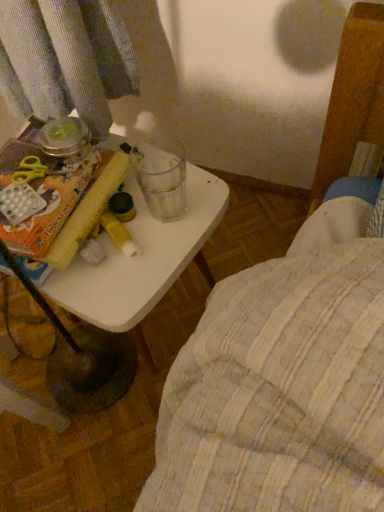
You are a GUI agent. You are given a task and a screenshot of the screen. Output one action in this format:
    pyautogui.click(x=<x>, y=<y>)
    Task: Click on the white plastic table at center
    The image size is (384, 512).
    Given the screenshot: What is the action you would take?
    pyautogui.click(x=143, y=261)

Image resolution: width=384 pixels, height=512 pixels. Describe the element at coordinates (143, 261) in the screenshot. I see `white plastic table at center` at that location.

Locate an element on the screen. The image size is (384, 512). yellow paper at left is located at coordinates (40, 194).

The width and height of the screenshot is (384, 512). What do you see at coordinates (40, 194) in the screenshot?
I see `yellow paper at left` at bounding box center [40, 194].

You are a GUI agent. You are given a task and a screenshot of the screen. Output one action in this format:
    pyautogui.click(x=<x>, y=<y>)
    Task: Click on the white plastic table at center
    The width and height of the screenshot is (384, 512).
    Given the screenshot: What is the action you would take?
    pyautogui.click(x=143, y=261)

Based on the photo, would you say white plastic table at center is to the left or to the right of yellow paper at left in the picture?

Based on their positions, white plastic table at center is located to the right of yellow paper at left.

Which object is closer to the camera, white plastic table at center or yellow paper at left?

yellow paper at left is closer to the camera.

Is point (219, 187) positioned in front of point (14, 194)?

No, (219, 187) is further to viewer.

From the image's perspective, which object appears higher, white plastic table at center or yellow paper at left?

yellow paper at left appears higher in the image.

From a real-world perspective, is white plastic table at center on top of yellow paper at left?

No, from a real-world perspective, white plastic table at center is not above yellow paper at left.

Can you confirm if white plastic table at center is thinner than yellow paper at left?

No.

Is white plastic table at center taller or shorter than yellow paper at left?

In the image, white plastic table at center appears to be taller than yellow paper at left.

Can you confirm if white plastic table at center is smaller than yellow paper at left?

Actually, white plastic table at center might be larger than yellow paper at left.

Is white plastic table at center outside of yellow paper at left?

Yes, white plastic table at center is outside of yellow paper at left.

Looking at this image, is white plastic table at center far away from yellow paper at left?

No, there isn't a large distance between white plastic table at center and yellow paper at left.

Is white plastic table at center aimed at yellow paper at left?

No, white plastic table at center is not turned towards yellow paper at left.

How much distance is there between white plastic table at center and yellow paper at left?

4.14 inches.

Locate an element on the screen. This screenshot has height=512, width=384. paperback book located above the white plastic table at center (from the image's perspective) is located at coordinates (40, 194).

Considering the relative positions of yellow paper at left and white plastic table at center in the image provided, is yellow paper at left to the left of white plastic table at center from the viewer's perspective?

Yes, yellow paper at left is to the left of white plastic table at center.

Which is behind, yellow paper at left or white plastic table at center?

white plastic table at center is further from the camera.

Does point (12, 211) lie in front of point (149, 252)?

Yes, it is.

From the image's perspective, between yellow paper at left and white plastic table at center, who is located below?

From the image's view, white plastic table at center is below.

Consider the image. From a real-world perspective, is yellow paper at left over white plastic table at center?

Correct, in the physical world, yellow paper at left is higher than white plastic table at center.

Can you confirm if yellow paper at left is thinner than white plastic table at center?

Indeed, yellow paper at left has a lesser width compared to white plastic table at center.

Which of these two, yellow paper at left or white plastic table at center, stands taller?

white plastic table at center.

In the scene shown: Considering the relative sizes of yellow paper at left and white plastic table at center in the image provided, is yellow paper at left bigger than white plastic table at center?

Incorrect, yellow paper at left is not larger than white plastic table at center.

Is white plastic table at center surrounded by yellow paper at left?

That's incorrect, white plastic table at center is not inside yellow paper at left.

Is the surface of yellow paper at left in direct contact with white plastic table at center?

No, yellow paper at left is not next to white plastic table at center.

Does yellow paper at left turn towards white plastic table at center?

No, yellow paper at left is not aimed at white plastic table at center.

Locate an element on the screen. paperback book on the left side of white plastic table at center is located at coordinates (40, 194).

This screenshot has width=384, height=512. I want to click on table behind the yellow paper at left, so click(x=143, y=261).

This screenshot has width=384, height=512. What are the coordinates of `paperback book on the left of white plastic table at center` in the screenshot? It's located at (40, 194).